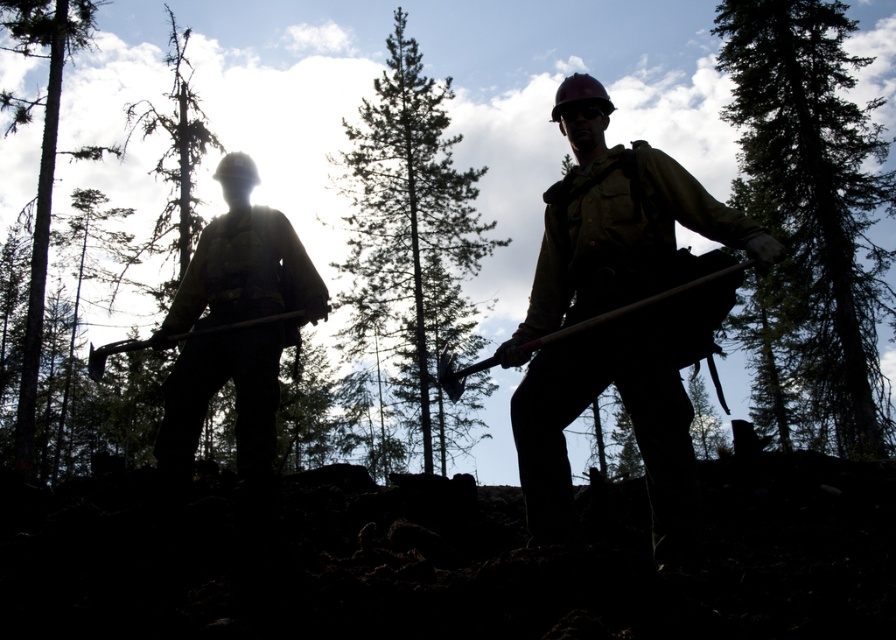
Question: Among these points, which one is nearest to the camera?

Choices:
 (A) (147, 118)
 (B) (308, 298)
 (C) (815, 372)
 (D) (521, 472)

Answer: (D)

Question: Can you confirm if matte black axe at center is positioned below smooth bark tree at left?

Choices:
 (A) no
 (B) yes

Answer: (B)

Question: Can you confirm if green textured tree at center is positioned to the left of matte yellow safety vest at left?

Choices:
 (A) yes
 (B) no

Answer: (B)

Question: Which point is farther to the camera?

Choices:
 (A) green textured tree at center
 (B) silhouette pine tree at left

Answer: (A)

Question: Considering the relative positions of matte black axe at center and matte yellow safety vest at left in the image provided, where is matte black axe at center located with respect to matte yellow safety vest at left?

Choices:
 (A) below
 (B) above

Answer: (B)

Question: Which of the following is the farthest from the observer?

Choices:
 (A) (668, 216)
 (B) (26, 452)
 (C) (418, 60)
 (D) (188, 195)

Answer: (C)